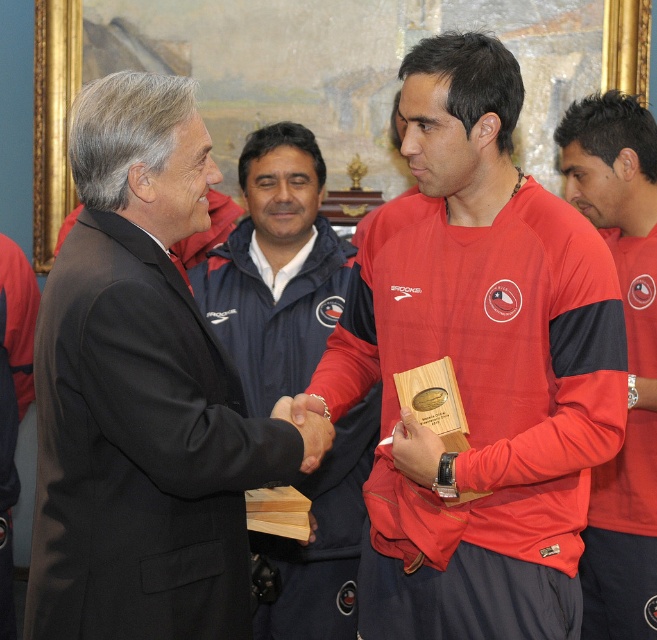
Looking at this image, can you confirm if black suit at center is thinner than red matte jersey at center?

No, black suit at center is not thinner than red matte jersey at center.

Does black suit at center appear under red matte jersey at center?

Incorrect, black suit at center is not positioned below red matte jersey at center.

Which is behind, point (244, 420) or point (614, 508)?

Point (614, 508)

This screenshot has width=657, height=640. In order to click on black suit at center in this screenshot , I will do `click(143, 394)`.

Does matte red jersey at center appear on the left side of red matte jersey at center?

Correct, you'll find matte red jersey at center to the left of red matte jersey at center.

Is matte red jersey at center bigger than red matte jersey at center?

Correct, matte red jersey at center is larger in size than red matte jersey at center.

Locate an element on the screen. matte red jersey at center is located at coordinates (478, 368).

Does black suit at center have a larger size compared to red matte jacket at center?

Yes, black suit at center is bigger than red matte jacket at center.

Does point (152, 497) come in front of point (212, 289)?

Yes.

Between point (51, 600) and point (323, 636), which one is positioned in front?

Point (51, 600) is in front.

Where is `black suit at center`? This screenshot has height=640, width=657. black suit at center is located at coordinates (143, 394).